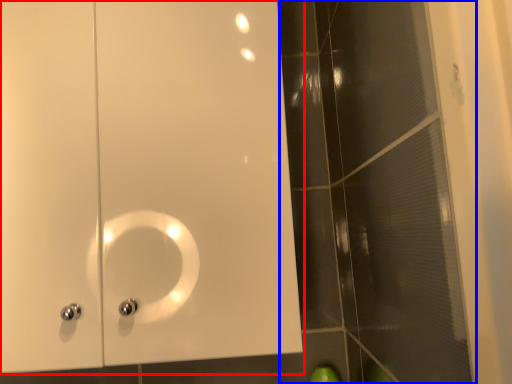
Question: Which point is further to the camera, door (highlighted by a red box) or glass door (highlighted by a blue box)?

Choices:
 (A) door
 (B) glass door

Answer: (A)